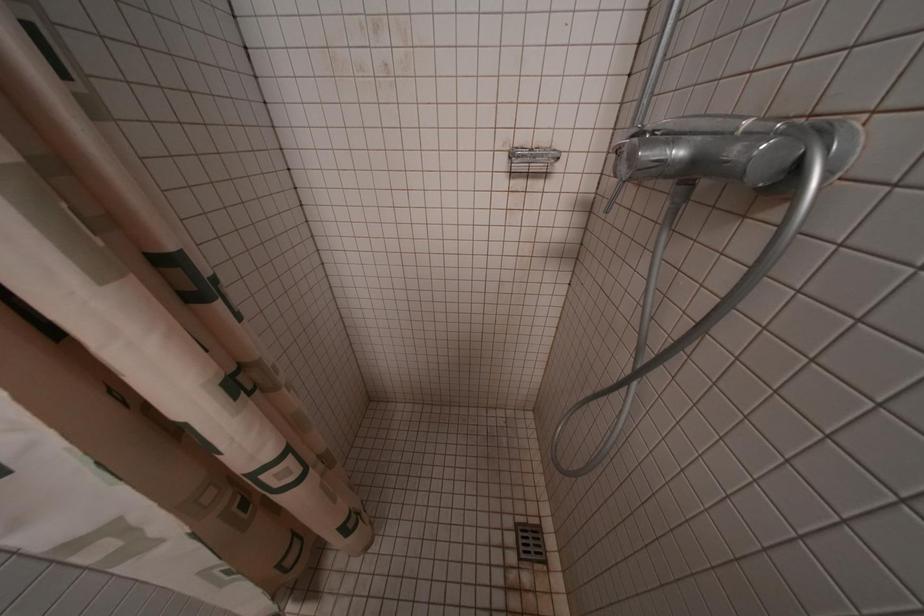
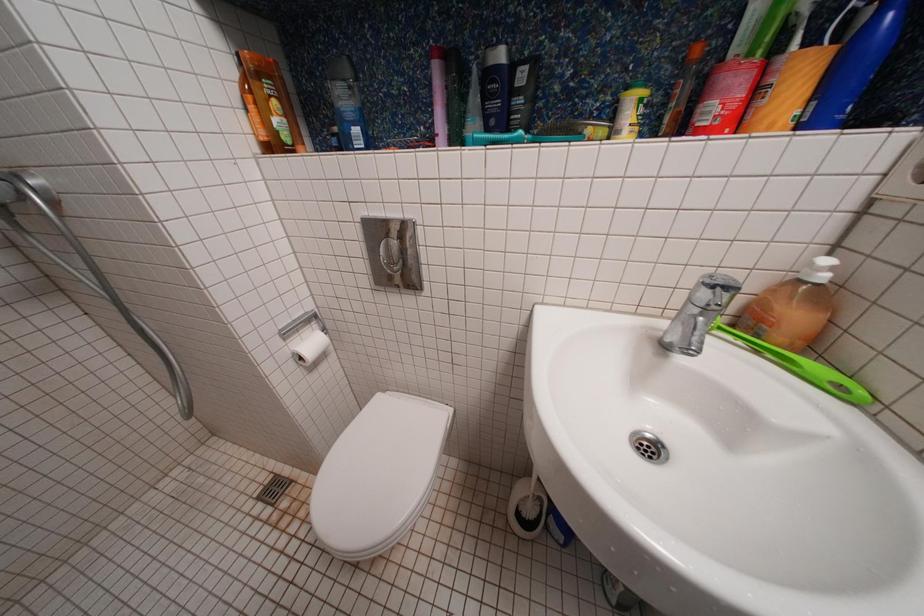
First-person continuous shooting, in which direction is the camera rotating?

The camera rotated toward right-down.